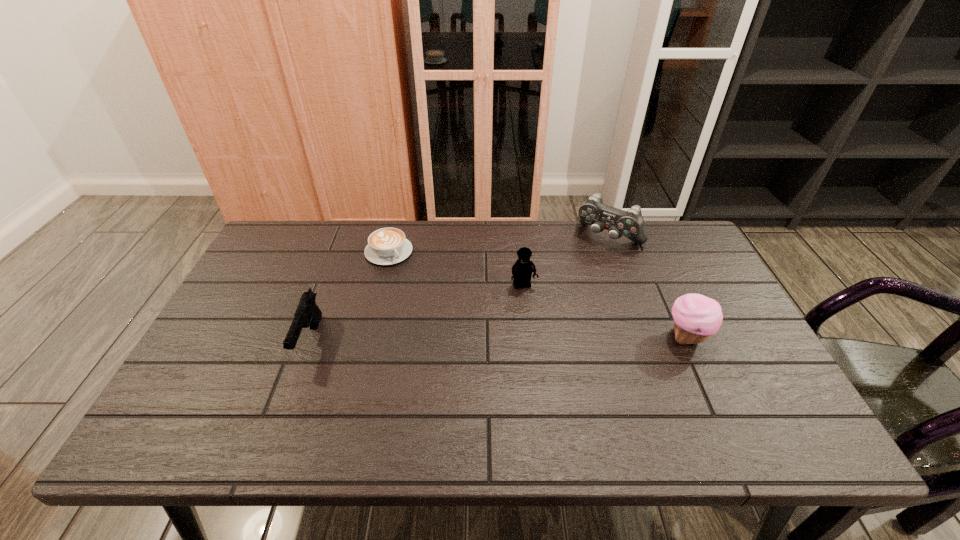
Where is `the fourth closest object to the cappuccino`? Image resolution: width=960 pixels, height=540 pixels. the fourth closest object to the cappuccino is located at coordinates (696, 317).

This screenshot has height=540, width=960. Identify the location of blank area in the image that satisfies the following two spatial constraints: 1. on the front side of the control; 2. on the left side of the cupcake. [645, 338].